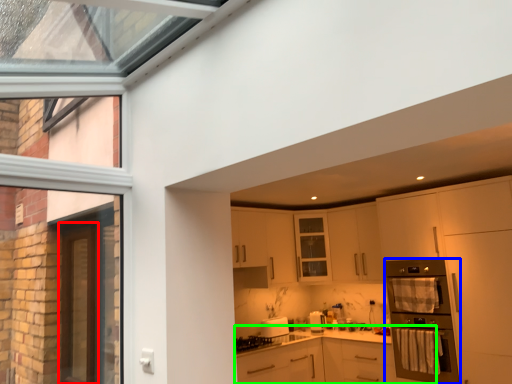
Question: Considering the real-world distances, which object is closest to screen door (highlighted by a red box)? home appliance (highlighted by a blue box) or cabinetry (highlighted by a green box).

Choices:
 (A) home appliance
 (B) cabinetry

Answer: (B)